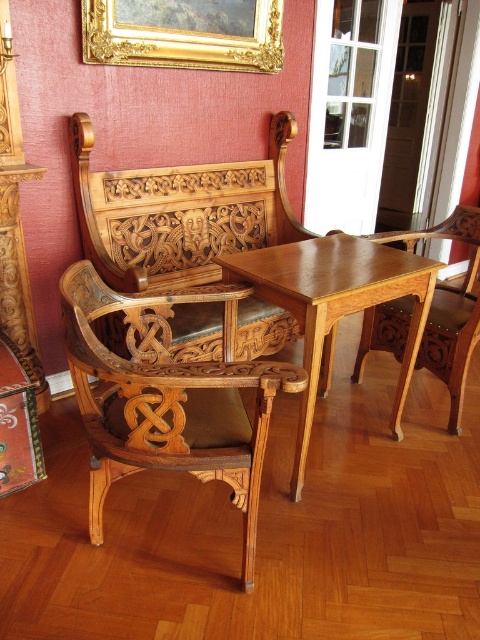
Question: Which point is farther to the camera?

Choices:
 (A) light brown wood armchair at center
 (B) gold ornate picture frame at upper center
 (C) light brown wood table at center

Answer: (A)

Question: Does light brown wood table at center appear over light brown wood armchair at center?

Choices:
 (A) yes
 (B) no

Answer: (B)

Question: Is the position of natural wood armchair at center less distant than that of light brown wood armchair at center?

Choices:
 (A) yes
 (B) no

Answer: (A)

Question: Does natural wood armchair at center have a greater width compared to light brown wood table at center?

Choices:
 (A) yes
 (B) no

Answer: (A)

Question: Estimate the real-world distances between objects in this image. Which object is farther from the gold ornate picture frame at upper center?

Choices:
 (A) light brown wood table at center
 (B) natural wood armchair at center

Answer: (B)

Question: Among these objects, which one is nearest to the camera?

Choices:
 (A) light brown wood table at center
 (B) light brown wood armchair at center

Answer: (A)